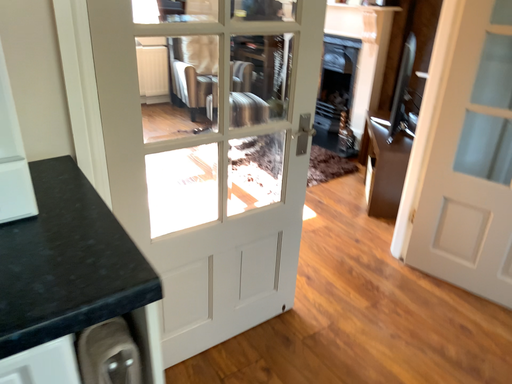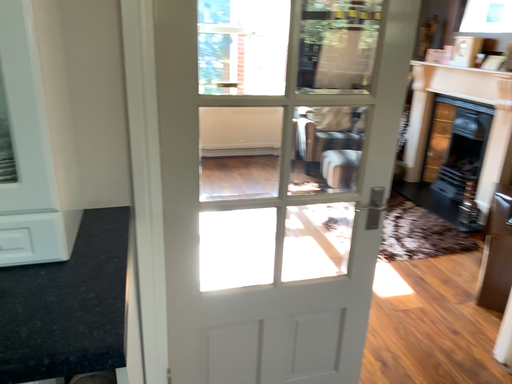
Question: How did the camera likely rotate when shooting the video?

Choices:
 (A) rotated downward
 (B) rotated upward

Answer: (B)